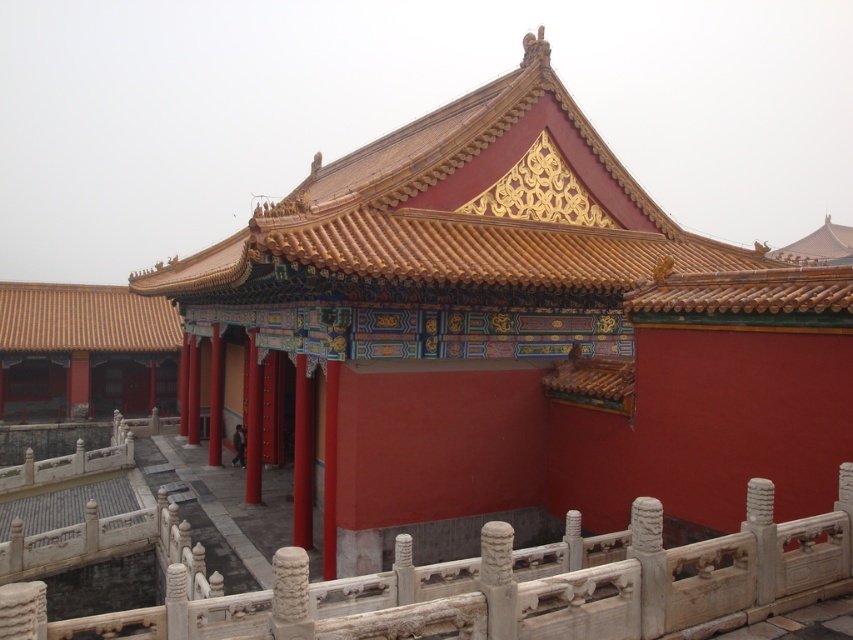
You are an architect examining the traditional Chinese structure. You notice the golden glazed tiles at upper center and the brown tile roof at upper left. Which of these two has a larger tile size?

The golden glazed tiles at upper center has a larger size compared to the brown tile roof at upper left.

You are standing in front of the traditional Chinese architectural structure. You notice the white stone railing at lower center and the brown tile roof at upper left. Which object is nearer to you?

The white stone railing at lower center is closer to the viewer than the brown tile roof at upper left.